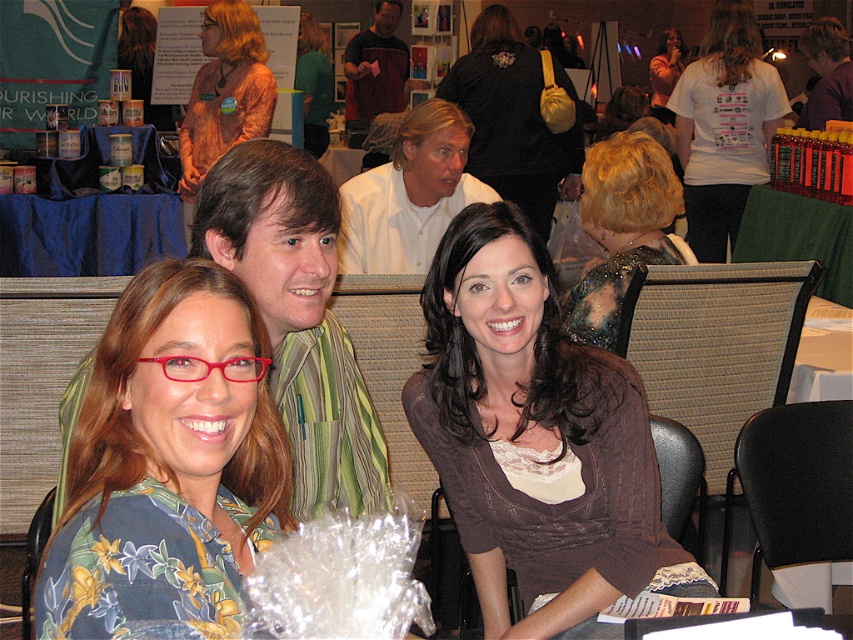
You are a photographer at the event and want to take a closeup of the printed silk blouse at upper left and the green fabric shirt at upper center. Which one can you focus on without adjusting your camera focus?

The printed silk blouse at upper left is closer to the viewer than the green fabric shirt at upper center, so focusing on the printed silk blouse at upper left will keep it in focus without needing to adjust the camera focus for the green fabric shirt at upper center.